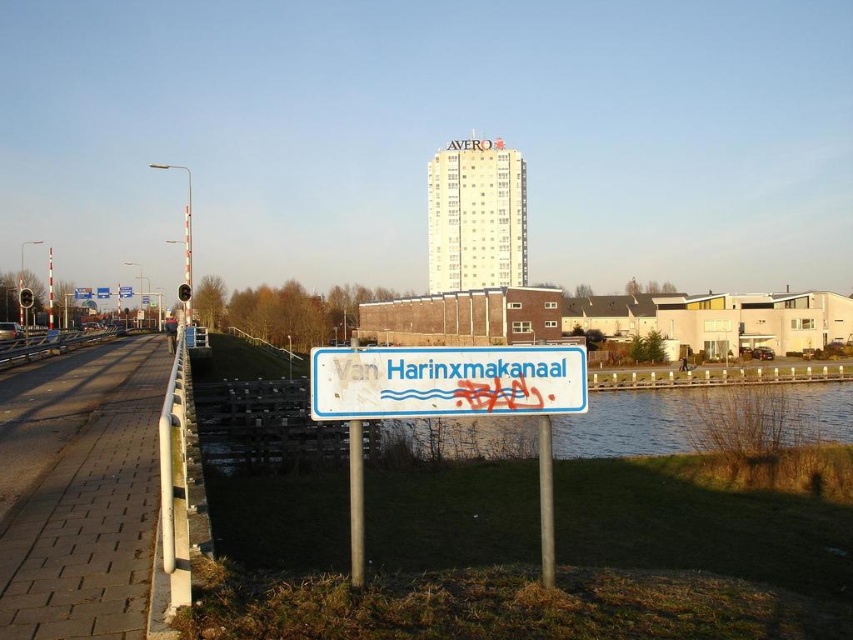
You are standing at the signpost with the text Van Harinxmakanaal and want to walk to both point (480, 364) and point (546, 486). Which point should you reach first to follow the shortest path?

You should reach point (480, 364) first because it is closer to the viewer than point (546, 486), so it is nearer to the starting point at the signpost.

You are a pedestrian standing on the pathway and want to know which object is taller between the white plastic sign at center and the metallic pole at center. Can you determine this?

The metallic pole at center is taller than the white plastic sign at center.